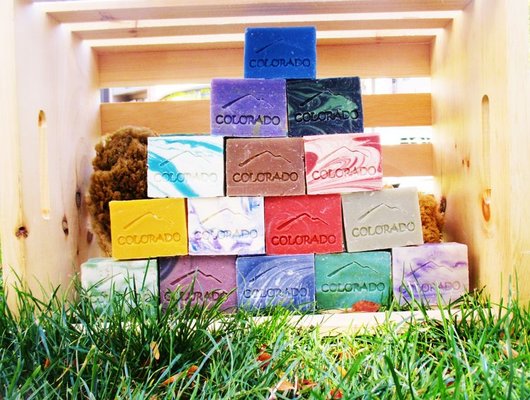
I want to click on decorative soap, so click(x=300, y=231).